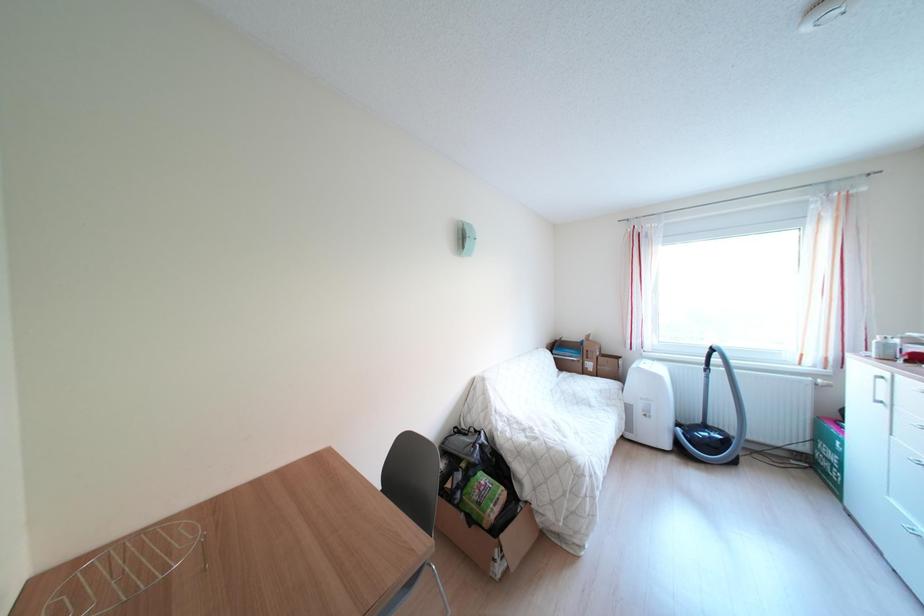
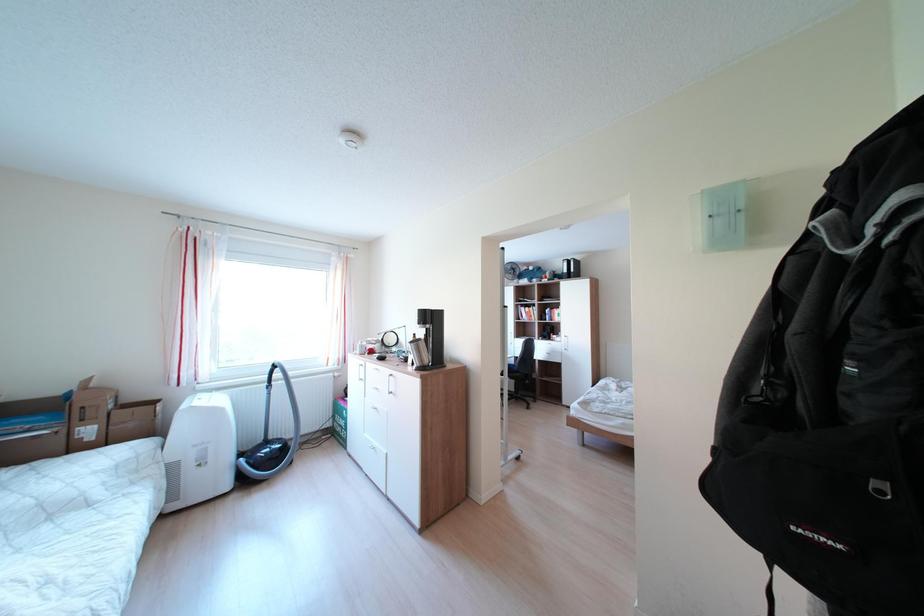
Question: The camera is either moving clockwise (left) or counter-clockwise (right) around the object. The first image is from the beginning of the video and the second image is from the end. Is the camera moving left or right when shooting the video?

Choices:
 (A) Left
 (B) Right

Answer: (A)